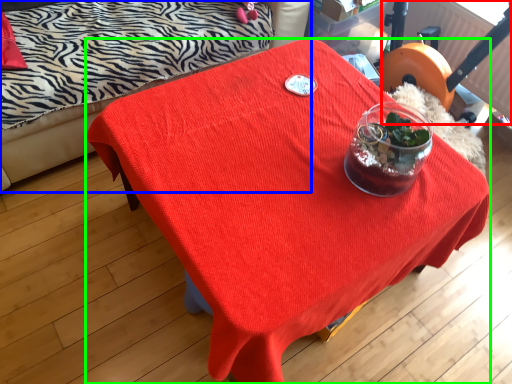
Question: Estimate the real-world distances between objects in this image. Which object is farther from swivel chair (highlighted by a red box), studio couch (highlighted by a blue box) or desk (highlighted by a green box)?

Choices:
 (A) studio couch
 (B) desk

Answer: (A)